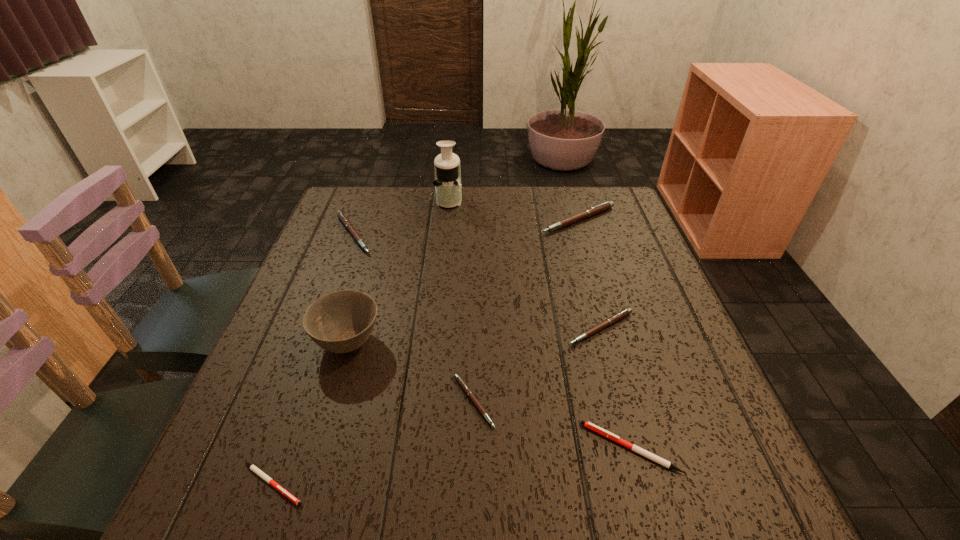
The width and height of the screenshot is (960, 540). In the image, there is a desktop. In order to click on vacant space at the far edge in this screenshot , I will do `click(461, 212)`.

Locate an element on the screen. Image resolution: width=960 pixels, height=540 pixels. vacant space at the near edge is located at coordinates (491, 494).

Locate an element on the screen. The width and height of the screenshot is (960, 540). vacant space at the left edge of the desktop is located at coordinates (350, 264).

The image size is (960, 540). What are the coordinates of `vacant space at the right edge of the desktop` in the screenshot? It's located at (626, 259).

Locate an element on the screen. The image size is (960, 540). free space at the far right corner of the desktop is located at coordinates (603, 186).

You are a GUI agent. You are given a task and a screenshot of the screen. Output one action in this format:
    pyautogui.click(x=<x>, y=<y>)
    Task: Click on the free space at the near right corner of the desktop
    This screenshot has width=960, height=540.
    Given the screenshot: What is the action you would take?
    pyautogui.click(x=684, y=486)

Identify the location of free spot between the fourth object from right to left and the seventh shortest object. This screenshot has width=960, height=540. (411, 372).

I want to click on vacant space that's between the bigger white pen and the tallest object, so click(540, 323).

Locate an element on the screen. The width and height of the screenshot is (960, 540). vacant space that's between the tallest object and the bigger white pen is located at coordinates pyautogui.click(x=540, y=323).

Locate an element on the screen. Image resolution: width=960 pixels, height=540 pixels. empty space that is in between the leftmost pink pen and the biggest pink pen is located at coordinates (466, 227).